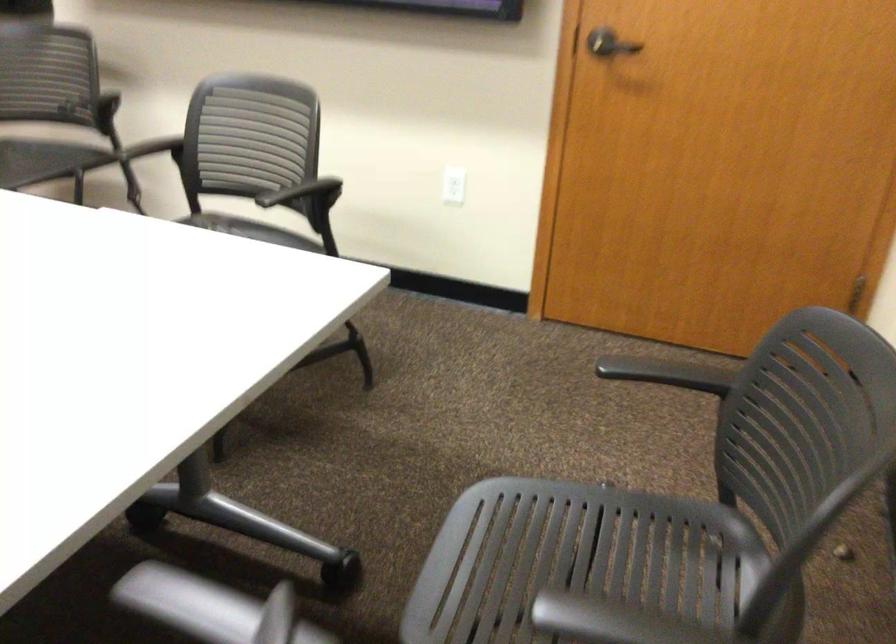
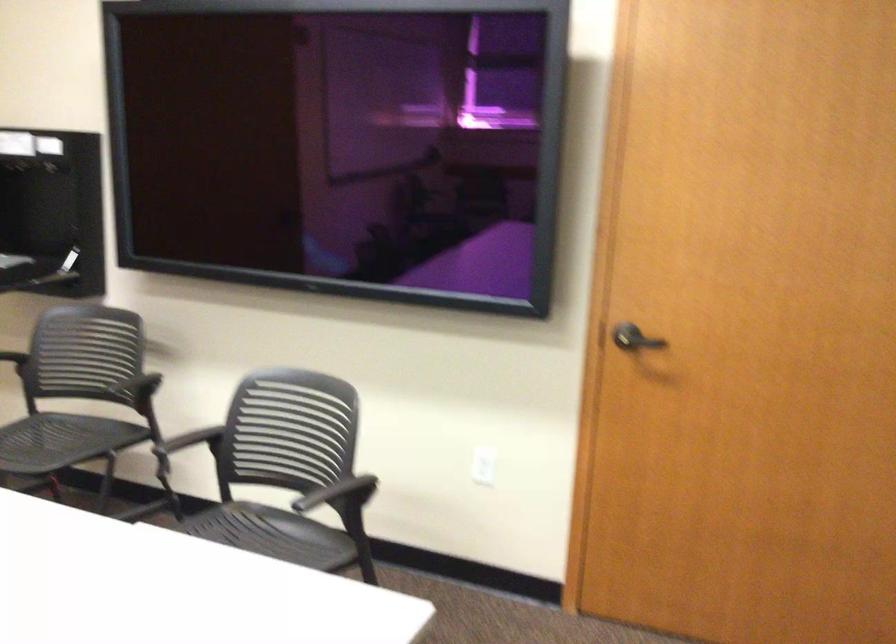
In the second image, find the point that corresponds to the point at 154,149 in the first image.

(191, 440)